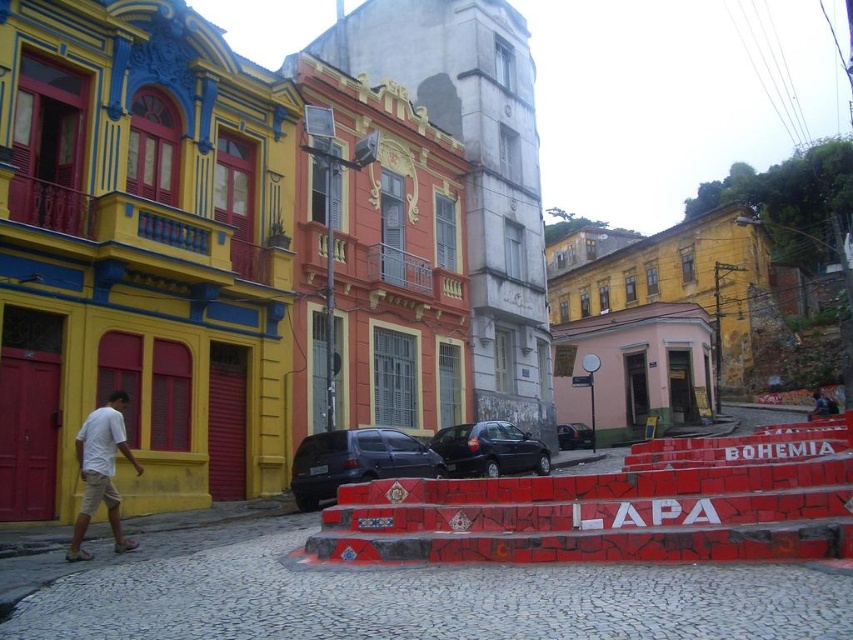
Question: Is shiny black suv at center above white cotton shirt at lower left?

Choices:
 (A) no
 (B) yes

Answer: (A)

Question: Which object appears farthest from the camera in this image?

Choices:
 (A) matte black car at center
 (B) shiny black suv at center
 (C) white cotton shirt at lower left

Answer: (A)

Question: Does shiny black suv at center have a larger size compared to matte black car at center?

Choices:
 (A) no
 (B) yes

Answer: (B)

Question: Which point appears closest to the camera in this image?

Choices:
 (A) (88, 506)
 (B) (494, 449)

Answer: (A)

Question: Which point is farther to the camera?

Choices:
 (A) matte black car at center
 (B) red painted stone stairs at lower center
 (C) shiny black car at center

Answer: (A)

Question: Is shiny black suv at center positioned at the back of shiny black car at center?

Choices:
 (A) yes
 (B) no

Answer: (B)